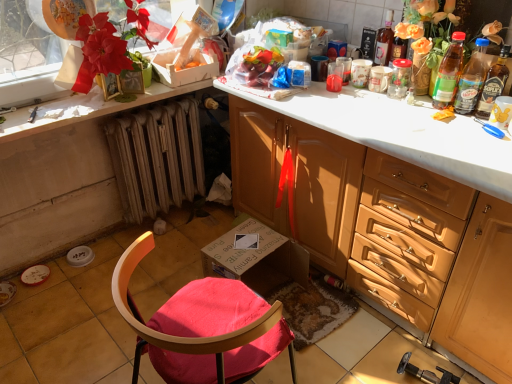
Question: Should I look upward or downward to see matte wood cabinet at center?

Choices:
 (A) down
 (B) up

Answer: (A)

Question: Does translucent plastic bottle at upper right, acting as the 4th bottle starting from the left, have a smaller size compared to translucent plastic bottle at upper center, which is the 4th bottle in right-to-left order?

Choices:
 (A) no
 (B) yes

Answer: (A)

Question: From a real-world perspective, is translucent plastic bottle at upper right, acting as the 4th bottle starting from the left, positioned over translucent plastic bottle at upper center, which is the 4th bottle in right-to-left order, based on gravity?

Choices:
 (A) yes
 (B) no

Answer: (B)

Question: Can you confirm if translucent plastic bottle at upper right, the 1th bottle when ordered from right to left, is bigger than translucent plastic bottle at upper center, which is counted as the first bottle, starting from the left?

Choices:
 (A) no
 (B) yes

Answer: (B)

Question: Is translucent plastic bottle at upper right, the 1th bottle when ordered from right to left, surrounding translucent plastic bottle at upper center, which is counted as the first bottle, starting from the left?

Choices:
 (A) yes
 (B) no

Answer: (B)

Question: Does translucent plastic bottle at upper right, acting as the 4th bottle starting from the left, have a lesser height compared to translucent plastic bottle at upper center, which is the 4th bottle in right-to-left order?

Choices:
 (A) yes
 (B) no

Answer: (B)

Question: Is translucent plastic bottle at upper right, acting as the 4th bottle starting from the left, to the left of translucent plastic bottle at upper center, which is counted as the first bottle, starting from the left, from the viewer's perspective?

Choices:
 (A) yes
 (B) no

Answer: (B)

Question: Are matte wood cabinet at center and wooden chair at lower center located far from each other?

Choices:
 (A) yes
 (B) no

Answer: (B)

Question: Is matte wood cabinet at center positioned before wooden chair at lower center?

Choices:
 (A) yes
 (B) no

Answer: (B)

Question: Is matte wood cabinet at center oriented away from wooden chair at lower center?

Choices:
 (A) yes
 (B) no

Answer: (B)

Question: Is matte wood cabinet at center further to camera compared to wooden chair at lower center?

Choices:
 (A) no
 (B) yes

Answer: (B)

Question: Is matte wood cabinet at center not inside wooden chair at lower center?

Choices:
 (A) no
 (B) yes

Answer: (B)

Question: Considering the relative sizes of matte wood cabinet at center and wooden chair at lower center in the image provided, is matte wood cabinet at center bigger than wooden chair at lower center?

Choices:
 (A) no
 (B) yes

Answer: (B)

Question: Is translucent plastic bottle at upper right, which appears as the second bottle when viewed from the left, closer to the viewer compared to wooden radiator at lower left?

Choices:
 (A) yes
 (B) no

Answer: (A)